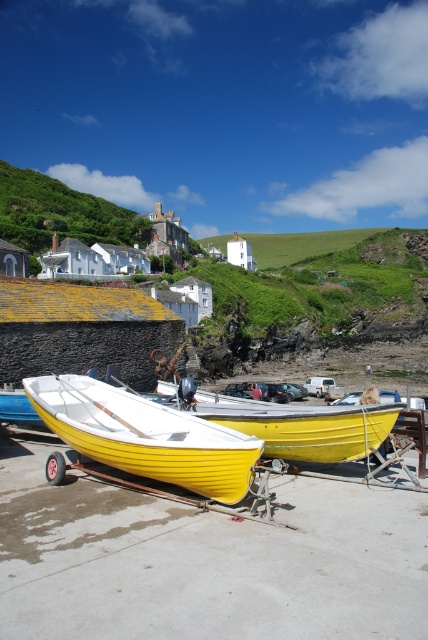
You are standing at the edge of the harbor and see the yellow matte boat at center and the yellow matte canoe at center. Which one is closer to you?

The yellow matte boat at center is closer to you because it is positioned in front of the yellow matte canoe at center.

You are a delivery person who needs to transport a package from the yellow matte boat at center to the yellow matte canoe at center. The package requires a clear path without obstacles. Given the distance between them, can you estimate if the space between the two is sufficient for moving the package?

The distance between the yellow matte boat at center and the yellow matte canoe at center is 6.96 meters. Since there are no obstacles mentioned in the scene description, the clear space should be sufficient for moving the package between them.

You are standing at the point with coordinates (x=145, y=435) in the harbor scene. What object is exactly at your current location?

The yellow matte boat at center is located at point (x=145, y=435), so the object at your current location is the yellow matte boat at center.